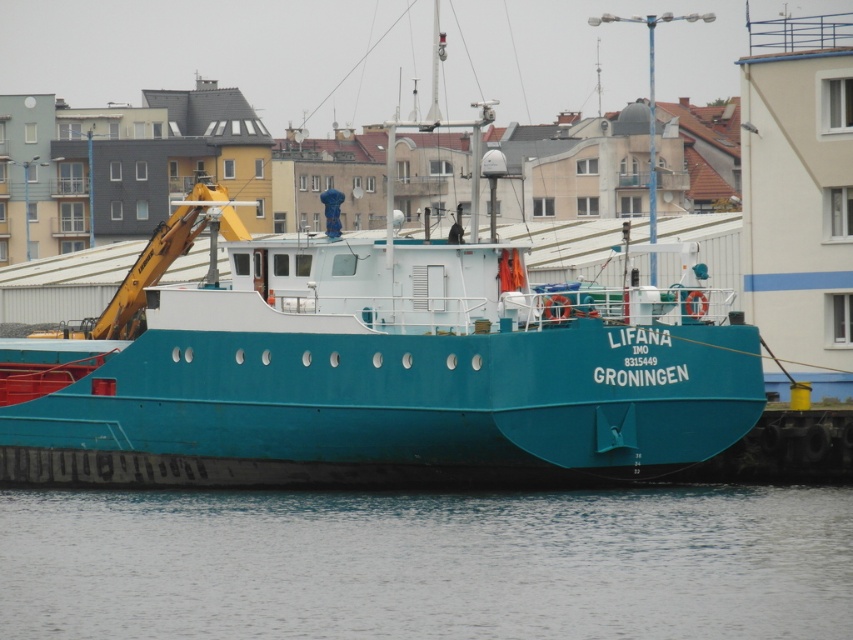
Which is more to the left, teal matte boat at center or transparent water at lower center?

teal matte boat at center is more to the left.

The width and height of the screenshot is (853, 640). Identify the location of teal matte boat at center. (373, 368).

Is point (244, 280) behind point (39, 541)?

Yes, it is behind point (39, 541).

This screenshot has width=853, height=640. Identify the location of teal matte boat at center. (373, 368).